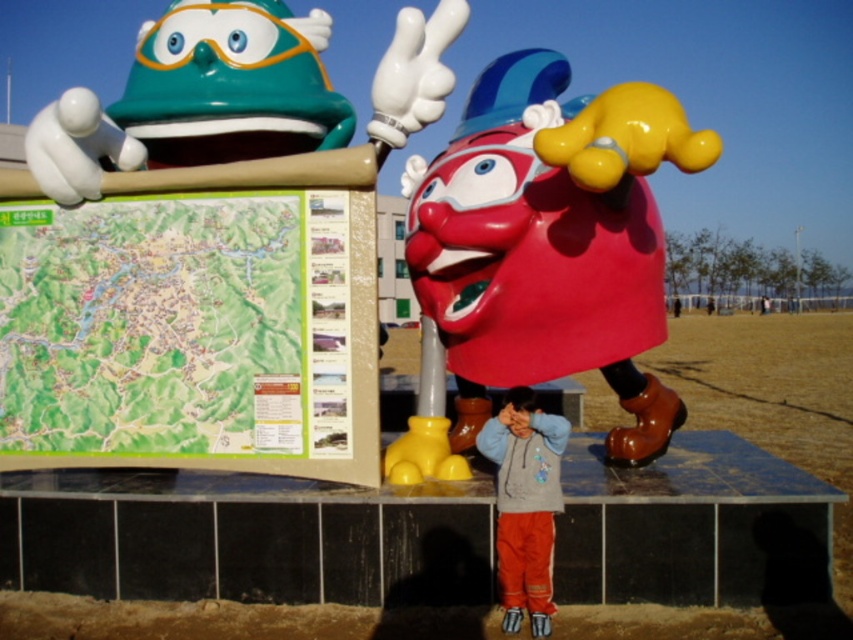
Who is lower down, shiny plastic helmet at upper left or shiny plastic clown at center?

shiny plastic clown at center is lower down.

Measure the distance between shiny plastic helmet at upper left and camera.

They are 4.57 meters apart.

Where is `shiny plastic helmet at upper left`? This screenshot has width=853, height=640. shiny plastic helmet at upper left is located at coordinates (202, 284).

Can you confirm if green paper map at upper left is shorter than light blue fleece jacket at center?

In fact, green paper map at upper left may be taller than light blue fleece jacket at center.

In the scene shown: Which is more to the left, green paper map at upper left or light blue fleece jacket at center?

Positioned to the left is green paper map at upper left.

Does point (212, 195) come farther from viewer compared to point (509, 621)?

Yes, it is.

Where is `green paper map at upper left`? This screenshot has width=853, height=640. green paper map at upper left is located at coordinates (154, 324).

The width and height of the screenshot is (853, 640). In order to click on teal glossy helmet at upper left in this screenshot , I will do `click(415, 72)`.

Describe the element at coordinates (415, 72) in the screenshot. I see `teal glossy helmet at upper left` at that location.

You are a GUI agent. You are given a task and a screenshot of the screen. Output one action in this format:
    pyautogui.click(x=<x>, y=<y>)
    Task: Click on the teal glossy helmet at upper left
    The image size is (853, 640).
    Given the screenshot: What is the action you would take?
    pyautogui.click(x=415, y=72)